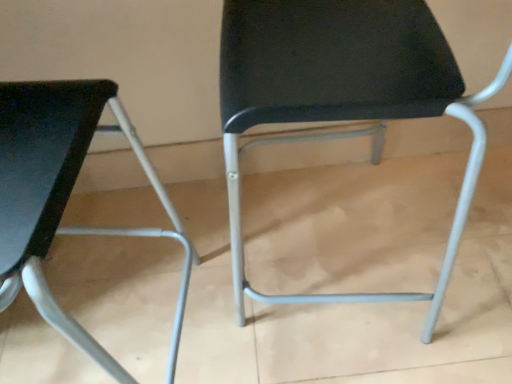
Find the location of a particular element. Image resolution: width=512 pixels, height=384 pixels. vacant area that lies between black fabric chair at center, acting as the 2th chair starting from the left, and matte black chair at left, the 2th chair in the right-to-left sequence is located at coordinates (231, 291).